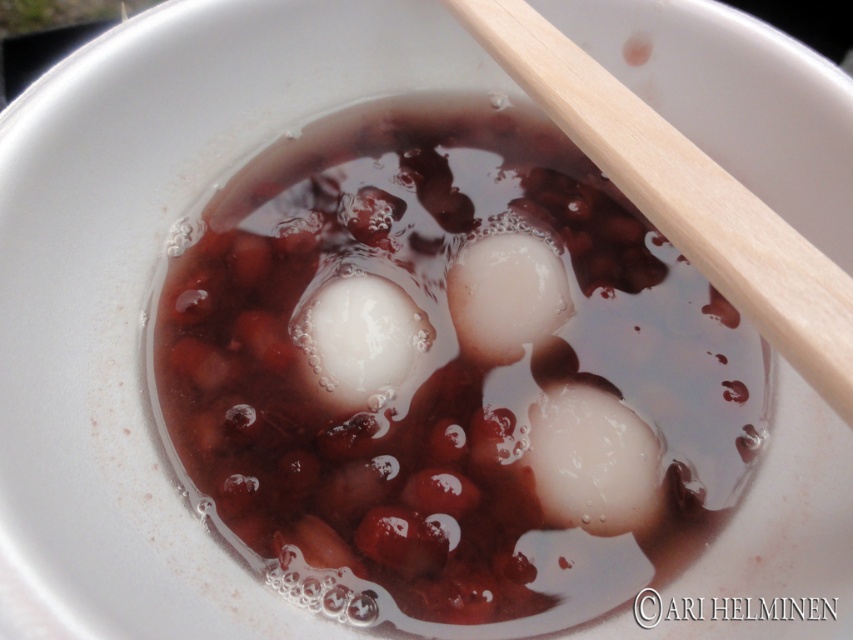
Between white glossy balls at center and wooden at upper right, which one appears on the right side from the viewer's perspective?

wooden at upper right is more to the right.

Describe the element at coordinates (448, 369) in the screenshot. I see `white glossy balls at center` at that location.

This screenshot has height=640, width=853. Identify the location of white glossy balls at center. (448, 369).